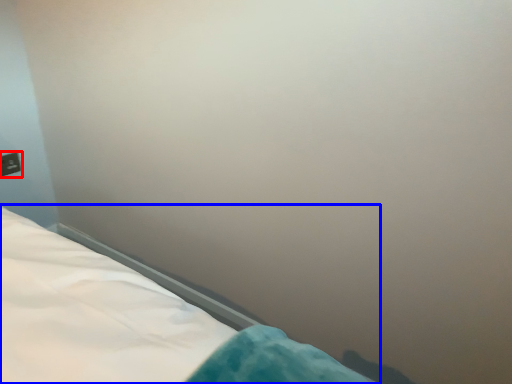
Question: Among these objects, which one is nearest to the camera, electric outlet (highlighted by a red box) or bed (highlighted by a blue box)?

Choices:
 (A) electric outlet
 (B) bed

Answer: (B)